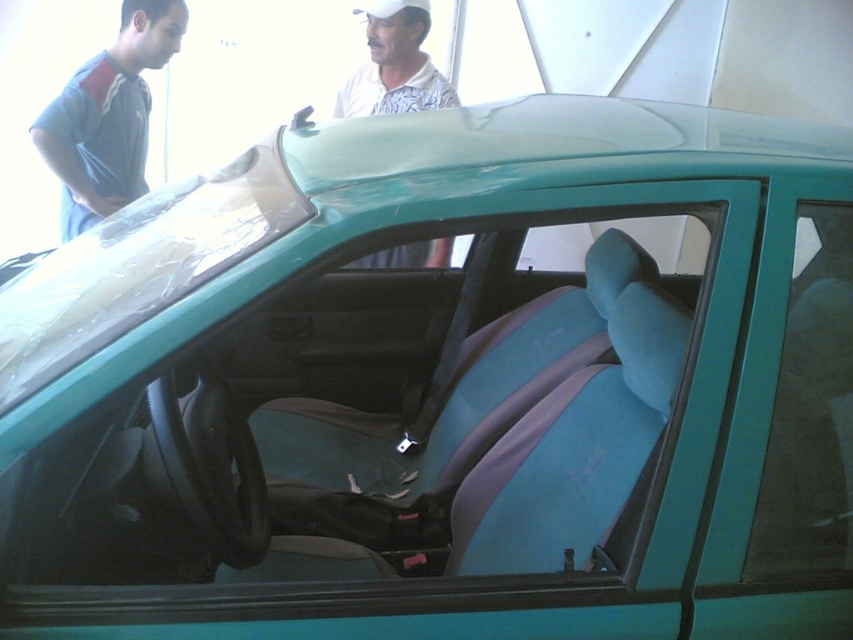
Question: Which point is closer to the camera?

Choices:
 (A) (444, 253)
 (B) (143, 92)

Answer: (A)

Question: Does gray fabric shirt at upper left appear under white printed shirt at upper center?

Choices:
 (A) no
 (B) yes

Answer: (B)

Question: Does gray fabric shirt at upper left have a greater width compared to white printed shirt at upper center?

Choices:
 (A) yes
 (B) no

Answer: (B)

Question: Which object appears closest to the camera in this image?

Choices:
 (A) white printed shirt at upper center
 (B) gray fabric shirt at upper left

Answer: (B)

Question: Is gray fabric shirt at upper left bigger than white printed shirt at upper center?

Choices:
 (A) no
 (B) yes

Answer: (B)

Question: Which of the following is the farthest from the observer?

Choices:
 (A) white printed shirt at upper center
 (B) gray fabric shirt at upper left

Answer: (A)